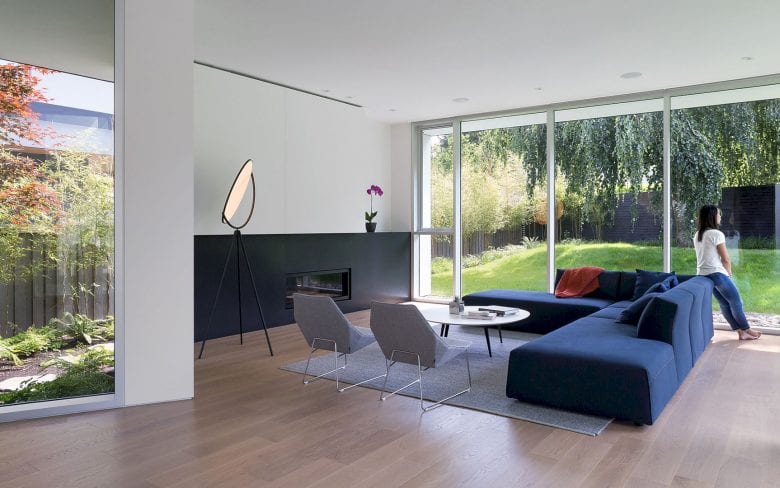
Image resolution: width=780 pixels, height=488 pixels. What are the coordinates of `floor to ceiling window` in the screenshot? It's located at (498, 180), (626, 193), (715, 173), (435, 188).